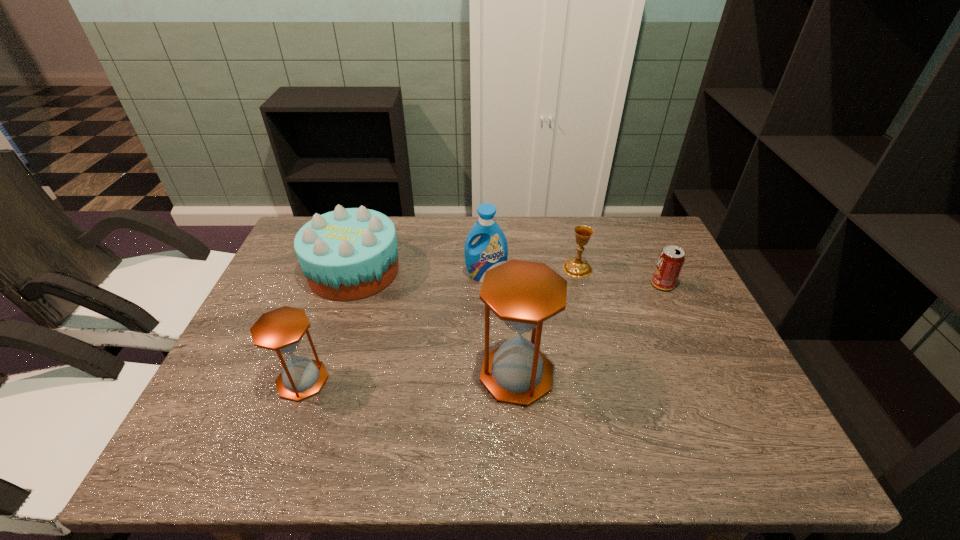
The height and width of the screenshot is (540, 960). Identify the location of vacant spot to place a hourglass on the right. (726, 369).